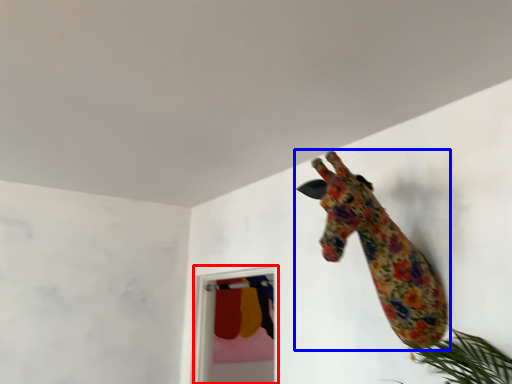
Question: Which point is closer to the camera, glass door (highlighted by a red box) or giraffe (highlighted by a blue box)?

Choices:
 (A) glass door
 (B) giraffe

Answer: (B)